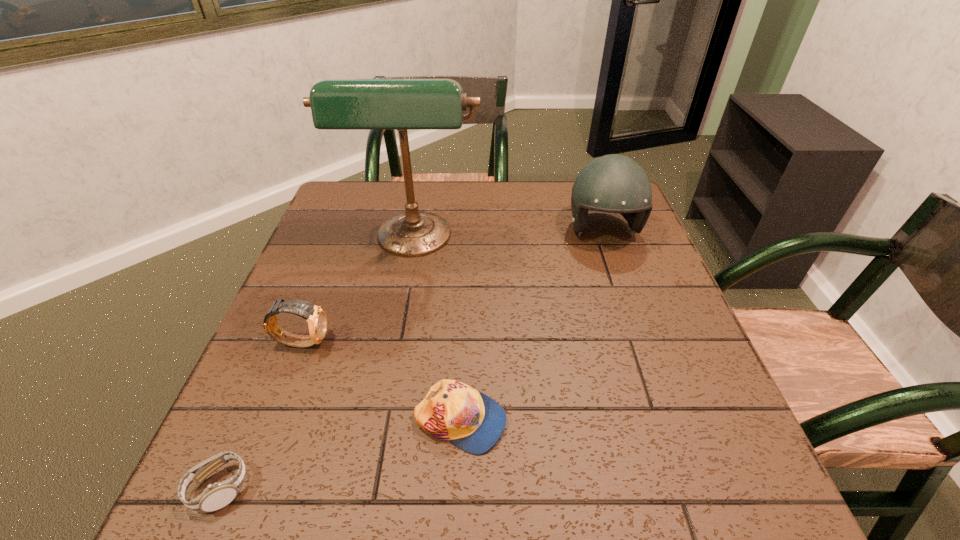
What are the coordinates of `free spot that satisfies the following two spatial constraints: 1. at the face opening of the rightmost object; 2. on the bill of the second nearest object` in the screenshot? It's located at (669, 421).

At what (x,y) coordinates should I click in order to perform the action: click on free point that satisfies the following two spatial constraints: 1. at the face opening of the second tallest object; 2. on the face of the third tallest object. Please return your answer as a coordinate pair (x, y). The height and width of the screenshot is (540, 960). Looking at the image, I should click on (642, 342).

This screenshot has height=540, width=960. Identify the location of vacant space that satisfies the following two spatial constraints: 1. at the face opening of the fourth shortest object; 2. on the face of the nearer watch. (693, 489).

Find the location of a particular element. This screenshot has height=540, width=960. vacant space that satisfies the following two spatial constraints: 1. at the face opening of the second tallest object; 2. on the bill of the cap is located at coordinates (669, 421).

This screenshot has height=540, width=960. I want to click on vacant region that satisfies the following two spatial constraints: 1. above the green lampshade of the table lamp; 2. on the face of the farther watch, so click(396, 342).